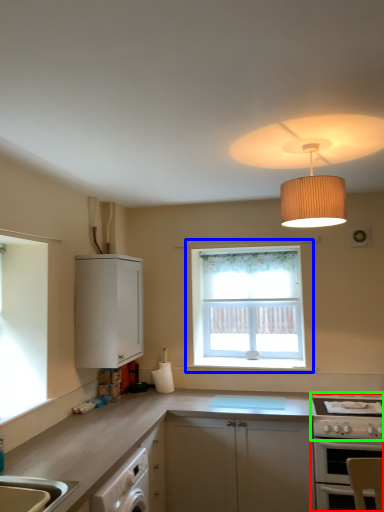
Question: Which object is the closest to the oven (highlighted by a red box)? Choose among these: window (highlighted by a blue box) or gas stove (highlighted by a green box).

Choices:
 (A) window
 (B) gas stove

Answer: (B)